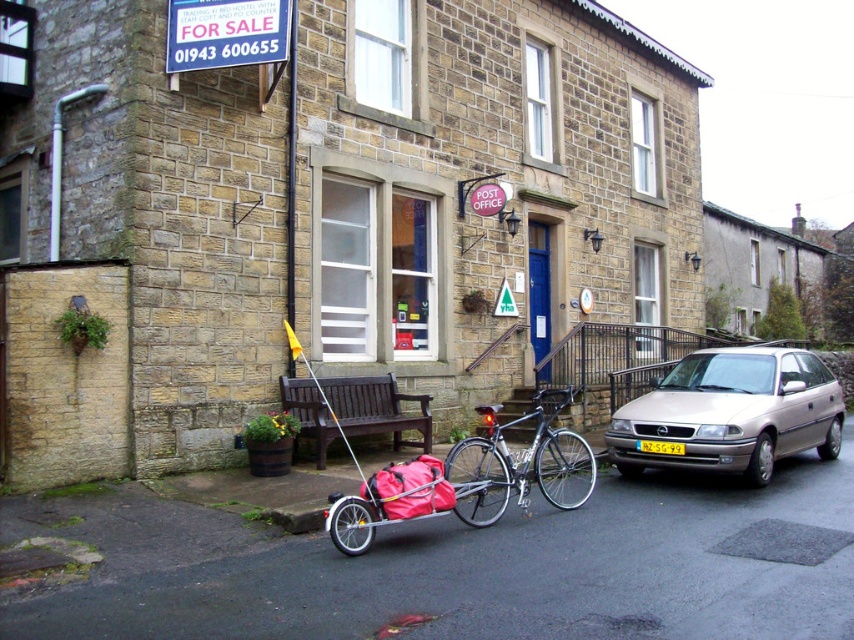
You are a delivery person trying to park your bike next to the brown wooden bench at center and the yellow plastic license plate at center. Which object should you avoid to ensure your bike has enough space?

The brown wooden bench at center is wider than the yellow plastic license plate at center. Therefore, you should avoid the brown wooden bench at center to ensure your bike has enough space.

You are a delivery person needing to park your 2.5 meter long delivery van between the shiny metallic bicycle at center and the brown wooden bench at center. Is there enough space?

The shiny metallic bicycle at center is 2.58 meters away from the brown wooden bench at center. Since the distance between them is just slightly more than the van length, the delivery van can fit between them with minimal space to spare.

You are a delivery person who needs to place a package on the brown wooden bench at center. Your delivery cart is parked 12 feet away from the bench. However, there is a yellow plastic license plate at center in between. Can you reach the bench without moving the license plate?

The distance between the brown wooden bench at center and the yellow plastic license plate at center is 11.96 feet. Since your cart is parked 12 feet away from the bench, the license plate is almost at the same distance. You might need to move the license plate to access the bench safely.